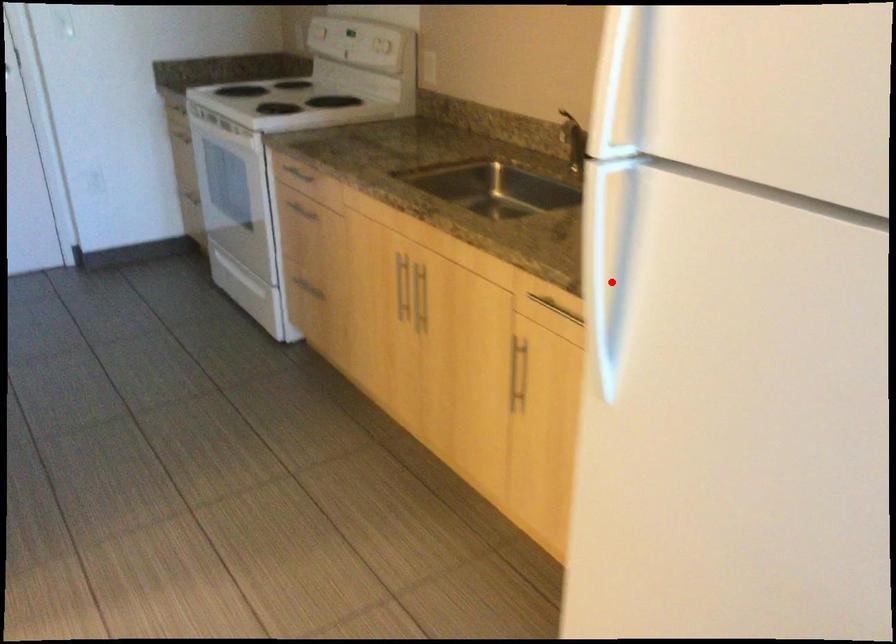
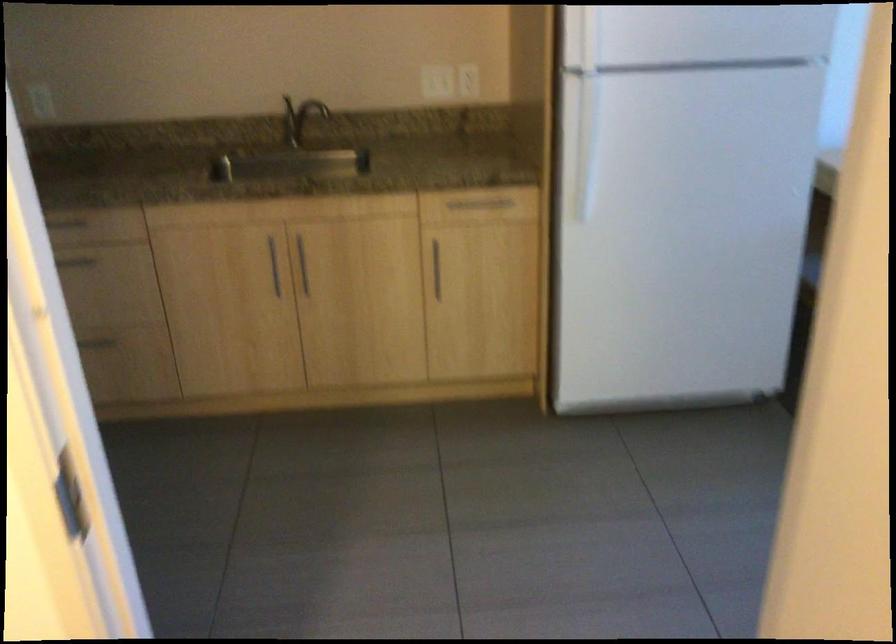
Find the pixel in the second image that matches the highlighted location in the first image.

(586, 146)